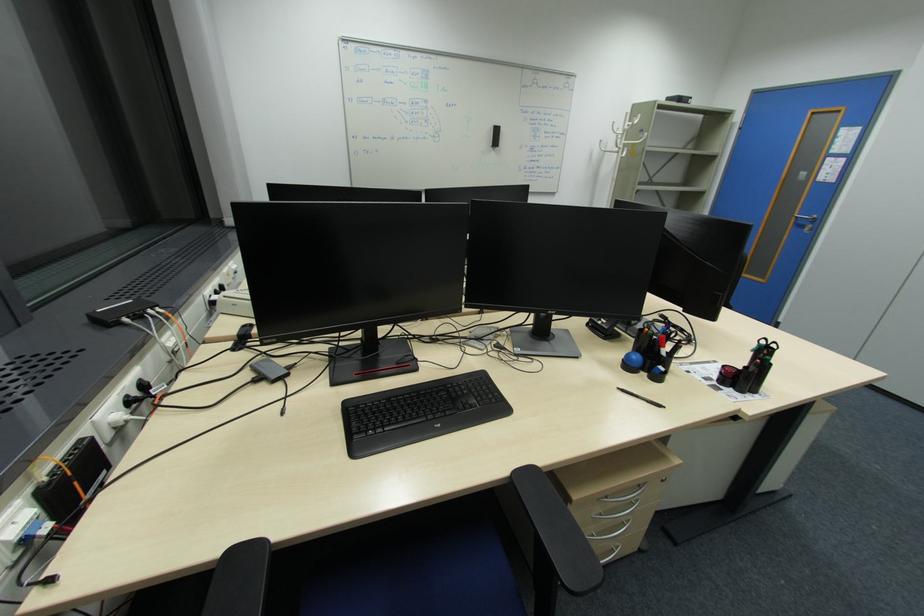
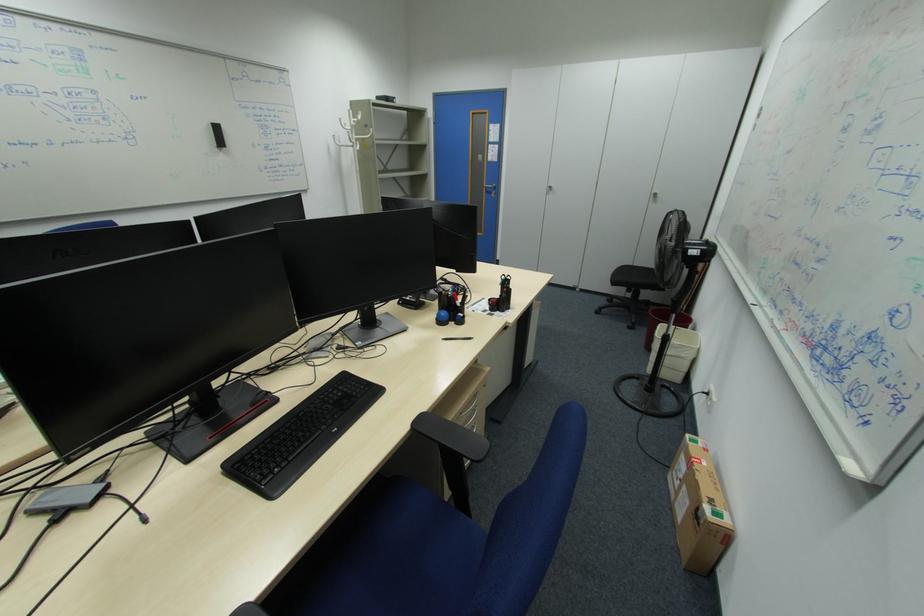
Question: The camera is either moving clockwise (left) or counter-clockwise (right) around the object. The first image is from the beginning of the video and the second image is from the end. Is the camera moving left or right when shooting the video?

Choices:
 (A) Left
 (B) Right

Answer: (A)